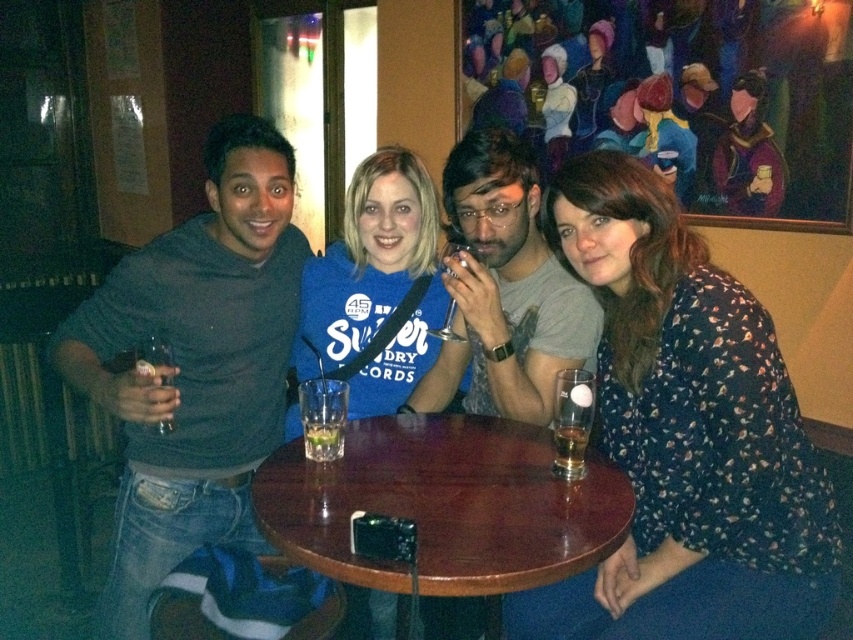
Question: Which object is the closest to the floral-patterned dress at center?

Choices:
 (A) gray cotton shirt at left
 (B) translucent glass beer at table center
 (C) wooden at center
 (D) blue cotton hoodie at center

Answer: (B)

Question: Which object appears closest to the camera in this image?

Choices:
 (A) clear glass at table center
 (B) gray cotton shirt at left
 (C) wooden at center

Answer: (C)

Question: Which of the following is the closest to the observer?

Choices:
 (A) floral-patterned dress at center
 (B) wooden at center
 (C) gray cotton shirt at left

Answer: (B)

Question: Can you confirm if wooden at center is positioned to the right of clear glass at table center?

Choices:
 (A) yes
 (B) no

Answer: (A)

Question: Can you confirm if blue cotton hoodie at center is positioned below matte gray shirt at center?

Choices:
 (A) no
 (B) yes

Answer: (B)

Question: Can you confirm if matte gray shirt at center is positioned below translucent glass beer at table center?

Choices:
 (A) no
 (B) yes

Answer: (A)